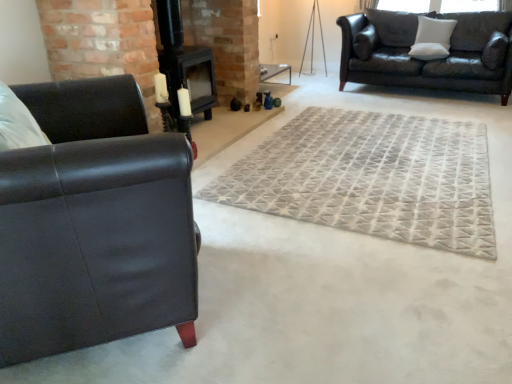
You are a GUI agent. You are given a task and a screenshot of the screen. Output one action in this format:
    pyautogui.click(x=<x>, y=<y>)
    Task: Click on the matte black couch at upper right, the first studio couch viewed from the right
    This screenshot has width=512, height=384.
    Given the screenshot: What is the action you would take?
    pyautogui.click(x=430, y=60)

Find the location of `white soft cushion at upper right, acting as the second pillow starting from the right`. white soft cushion at upper right, acting as the second pillow starting from the right is located at coordinates click(432, 38).

The image size is (512, 384). I want to click on white soft pillow at upper right, positioned as the first pillow in right-to-left order, so click(x=495, y=51).

From a real-world perspective, who is located higher, black matte fireplace at center or white soft cushion at upper right, acting as the second pillow starting from the right?

white soft cushion at upper right, acting as the second pillow starting from the right, is physically above.

Is black matte fireplace at center not near white soft cushion at upper right, acting as the second pillow starting from the right?

Indeed, black matte fireplace at center is not near white soft cushion at upper right, acting as the second pillow starting from the right.

Is black matte fireplace at center shorter than white soft cushion at upper right, acting as the second pillow starting from the right?

Incorrect, the height of black matte fireplace at center does not fall short of that of white soft cushion at upper right, acting as the second pillow starting from the right.

Between black matte fireplace at center and white soft cushion at upper right, which is counted as the first pillow, starting from the left, which one appears on the right side from the viewer's perspective?

white soft cushion at upper right, which is counted as the first pillow, starting from the left.

Which is less distant, (482, 75) or (94, 96)?

The point (94, 96) is closer to the camera.

Can you confirm if matte black couch at upper right, the 1th studio couch positioned from the top, is positioned to the left of matte black leather couch at left, which is counted as the 2th studio couch, starting from the right?

No, matte black couch at upper right, the 1th studio couch positioned from the top, is not to the left of matte black leather couch at left, which is counted as the 2th studio couch, starting from the right.

From the picture: From the image's perspective, relative to matte black leather couch at left, the 1th studio couch when ordered from front to back, is matte black couch at upper right, which is counted as the second studio couch, starting from the front, above or below?

matte black couch at upper right, which is counted as the second studio couch, starting from the front, is above matte black leather couch at left, the 1th studio couch when ordered from front to back.

Based on the photo, is matte black couch at upper right, the first studio couch viewed from the right, looking in the opposite direction of matte black leather couch at left, which appears as the 1th studio couch when viewed from the left?

No.

Which studio couch is the 1st one when counting from the left side of the white soft pillow at upper right, placed as the second pillow when sorted from left to right? Please provide its 2D coordinates.

[(430, 60)]

From the image's perspective, is matte black couch at upper right, the first studio couch viewed from the right, positioned above or below white soft pillow at upper right, placed as the second pillow when sorted from left to right?

matte black couch at upper right, the first studio couch viewed from the right, is above white soft pillow at upper right, placed as the second pillow when sorted from left to right.

Is matte black couch at upper right, the 1th studio couch viewed from the back, thinner than white soft pillow at upper right, placed as the second pillow when sorted from left to right?

In fact, matte black couch at upper right, the 1th studio couch viewed from the back, might be wider than white soft pillow at upper right, placed as the second pillow when sorted from left to right.

Can you confirm if matte black couch at upper right, which is counted as the second studio couch, starting from the front, is taller than white soft pillow at upper right, positioned as the first pillow in right-to-left order?

Correct, matte black couch at upper right, which is counted as the second studio couch, starting from the front, is much taller as white soft pillow at upper right, positioned as the first pillow in right-to-left order.

Where is `fireplace above the matte black couch at upper right, the first studio couch viewed from the right (from a real-world perspective)`? The width and height of the screenshot is (512, 384). fireplace above the matte black couch at upper right, the first studio couch viewed from the right (from a real-world perspective) is located at coordinates (184, 63).

Does matte black couch at upper right, the 1th studio couch positioned from the top, come behind black matte fireplace at center?

Yes, the depth of matte black couch at upper right, the 1th studio couch positioned from the top, is greater than that of black matte fireplace at center.

From a real-world perspective, which object stands above the other?

From a 3D spatial view, black matte fireplace at center is above.

Is matte black couch at upper right, acting as the 2th studio couch starting from the bottom, far from black matte fireplace at center?

Absolutely, matte black couch at upper right, acting as the 2th studio couch starting from the bottom, is distant from black matte fireplace at center.

Considering the relative positions of gray textured rug at center and white soft pillow at upper right, placed as the second pillow when sorted from left to right, in the image provided, is gray textured rug at center to the left or to the right of white soft pillow at upper right, placed as the second pillow when sorted from left to right,?

In the image, gray textured rug at center appears on the left side of white soft pillow at upper right, placed as the second pillow when sorted from left to right.

Can you tell me how much gray textured rug at center and white soft pillow at upper right, positioned as the first pillow in right-to-left order, differ in facing direction?

The angular difference between gray textured rug at center and white soft pillow at upper right, positioned as the first pillow in right-to-left order, is 90 degrees.

Which object is wider, gray textured rug at center or white soft pillow at upper right, positioned as the first pillow in right-to-left order?

With larger width is gray textured rug at center.

From a real-world perspective, between gray textured rug at center and white soft pillow at upper right, placed as the second pillow when sorted from left to right, who is vertically lower?

gray textured rug at center.

Between white soft cushion at upper right, acting as the second pillow starting from the right, and black matte fireplace at center, which one has smaller width?

white soft cushion at upper right, acting as the second pillow starting from the right, is thinner.

Does white soft cushion at upper right, acting as the second pillow starting from the right, contain black matte fireplace at center?

Actually, black matte fireplace at center is outside white soft cushion at upper right, acting as the second pillow starting from the right.

I want to click on pillow above the black matte fireplace at center (from a real-world perspective), so [432, 38].

Considering the points (440, 45) and (192, 65), which point is behind, point (440, 45) or point (192, 65)?

Point (440, 45)

Is point (355, 116) positioned behind point (69, 244)?

Yes, point (355, 116) is farther from viewer.

From the image's perspective, between gray textured rug at center and matte black leather couch at left, marked as the second studio couch in a back-to-front arrangement, which one is located above?

gray textured rug at center is shown above in the image.

Based on the photo, in terms of size, does gray textured rug at center appear bigger or smaller than matte black leather couch at left, which appears as the 1th studio couch when viewed from the left?

Considering their sizes, gray textured rug at center takes up less space than matte black leather couch at left, which appears as the 1th studio couch when viewed from the left.

Which is more to the left, gray textured rug at center or matte black leather couch at left, the 1th studio couch when ordered from front to back?

matte black leather couch at left, the 1th studio couch when ordered from front to back.

This screenshot has height=384, width=512. What are the coordinates of `pillow that is the 1st object to the right of the black matte fireplace at center, starting at the anchor` in the screenshot? It's located at (432, 38).

Locate an element on the screen. This screenshot has height=384, width=512. studio couch in front of the matte black couch at upper right, the 1th studio couch positioned from the top is located at coordinates (94, 224).

Looking at the image, which one is located further to gray textured rug at center, black matte fireplace at center or white soft pillow at upper right, positioned as the first pillow in right-to-left order?

white soft pillow at upper right, positioned as the first pillow in right-to-left order, is further to gray textured rug at center.

Consider the image. When comparing their distances from matte black couch at upper right, which is counted as the second studio couch, starting from the front, does gray textured rug at center or matte black leather couch at left, the 1th studio couch positioned from the bottom, seem closer?

Based on the image, gray textured rug at center appears to be nearer to matte black couch at upper right, which is counted as the second studio couch, starting from the front.

Based on their spatial positions, is gray textured rug at center or white soft cushion at upper right, acting as the second pillow starting from the right, further from matte black leather couch at left, marked as the second studio couch in a back-to-front arrangement?

Among the two, white soft cushion at upper right, acting as the second pillow starting from the right, is located further to matte black leather couch at left, marked as the second studio couch in a back-to-front arrangement.

Considering their positions, is matte black couch at upper right, acting as the 2th studio couch starting from the bottom, positioned further to white soft pillow at upper right, positioned as the first pillow in right-to-left order, than black matte fireplace at center?

black matte fireplace at center.

Based on their spatial positions, is white soft pillow at upper right, positioned as the first pillow in right-to-left order, or matte black leather couch at left, the 1th studio couch when ordered from front to back, closer to black matte fireplace at center?

Among the two, matte black leather couch at left, the 1th studio couch when ordered from front to back, is located nearer to black matte fireplace at center.

Based on their spatial positions, is white soft pillow at upper right, placed as the second pillow when sorted from left to right, or black matte fireplace at center further from matte black couch at upper right, the 1th studio couch viewed from the back?

black matte fireplace at center lies further to matte black couch at upper right, the 1th studio couch viewed from the back, than the other object.

When comparing their distances from white soft cushion at upper right, acting as the second pillow starting from the right, does matte black couch at upper right, which is counted as the second studio couch, starting from the front, or black matte fireplace at center seem further?

black matte fireplace at center lies further to white soft cushion at upper right, acting as the second pillow starting from the right, than the other object.

Based on their spatial positions, is white soft cushion at upper right, acting as the second pillow starting from the right, or white soft pillow at upper right, placed as the second pillow when sorted from left to right, further from matte black leather couch at left, the 1th studio couch when ordered from front to back?

white soft pillow at upper right, placed as the second pillow when sorted from left to right, lies further to matte black leather couch at left, the 1th studio couch when ordered from front to back, than the other object.

The height and width of the screenshot is (384, 512). I want to click on mat between black matte fireplace at center and white soft pillow at upper right, positioned as the first pillow in right-to-left order, so click(371, 178).

Identify the location of mat positioned between matte black leather couch at left, which is counted as the 2th studio couch, starting from the right, and black matte fireplace at center from near to far. (371, 178).

Identify the location of pillow between matte black couch at upper right, which is counted as the second studio couch, starting from the front, and white soft cushion at upper right, which is counted as the first pillow, starting from the left, from front to back. The image size is (512, 384). (495, 51).

Where is `mat positioned between matte black leather couch at left, which is counted as the 2th studio couch, starting from the right, and white soft pillow at upper right, positioned as the first pillow in right-to-left order, from near to far`? The width and height of the screenshot is (512, 384). mat positioned between matte black leather couch at left, which is counted as the 2th studio couch, starting from the right, and white soft pillow at upper right, positioned as the first pillow in right-to-left order, from near to far is located at coordinates (371, 178).